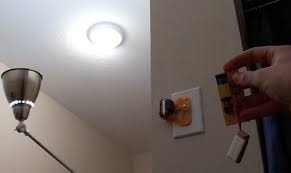
Where is `wall outlet`? This screenshot has width=291, height=173. wall outlet is located at coordinates (195, 117).